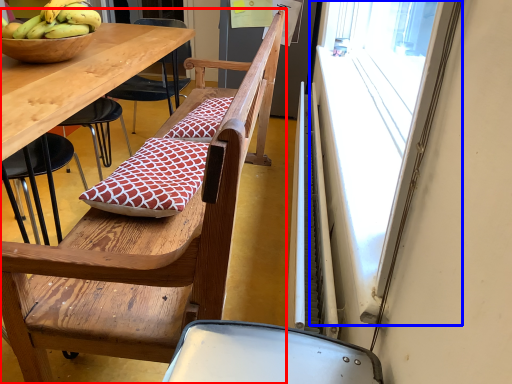
Question: Which object is closer to the camera taking this photo, chair (highlighted by a red box) or window screen (highlighted by a blue box)?

Choices:
 (A) chair
 (B) window screen

Answer: (B)